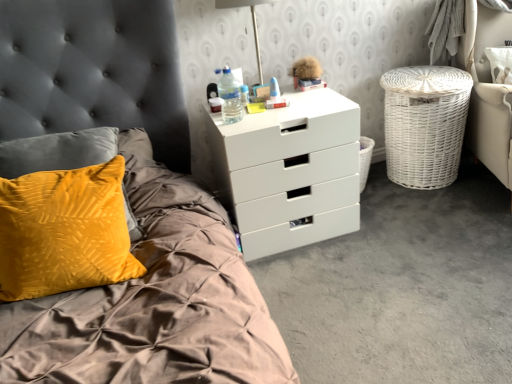
Question: Is metallic silver lamp at upper center inside the boundaries of white plastic chest of drawers at upper center, or outside?

Choices:
 (A) inside
 (B) outside

Answer: (B)

Question: Looking at their shapes, would you say metallic silver lamp at upper center is wider or thinner than white plastic chest of drawers at upper center?

Choices:
 (A) wide
 (B) thin

Answer: (B)

Question: Which object is the farthest from the white wicker laundry basket at right?

Choices:
 (A) white wicker armchair at right
 (B) metallic silver lamp at upper center
 (C) translucent plastic water bottle at upper right
 (D) white plastic chest of drawers at upper center

Answer: (C)

Question: Which is nearer to the white wicker laundry basket at right?

Choices:
 (A) white wicker armchair at right
 (B) metallic silver lamp at upper center
 (C) translucent plastic water bottle at upper right
 (D) white plastic chest of drawers at upper center

Answer: (A)